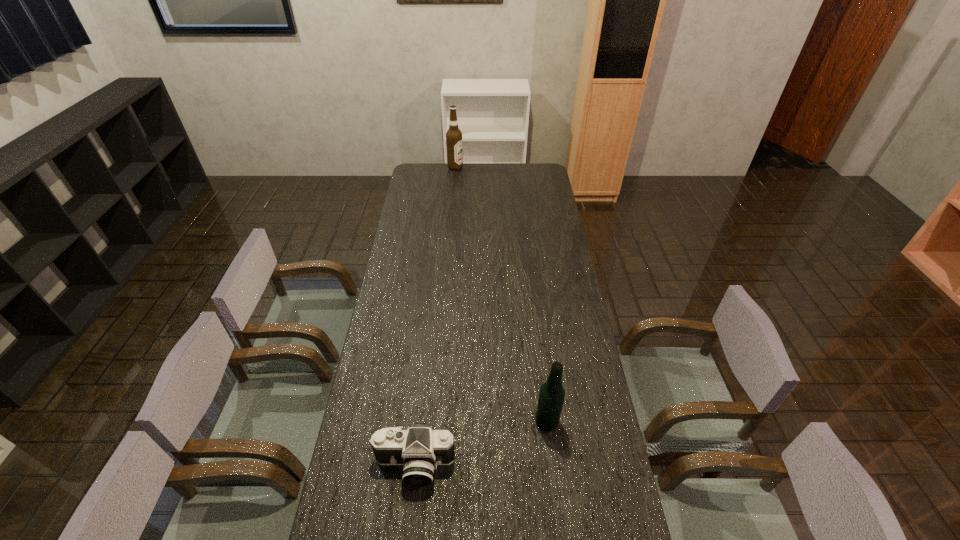
Image resolution: width=960 pixels, height=540 pixels. I want to click on object at the left edge, so click(420, 449).

Image resolution: width=960 pixels, height=540 pixels. In order to click on object at the right edge in this screenshot , I will do `click(551, 397)`.

Find the location of a particular element. This screenshot has width=960, height=540. vacant position at the far edge of the desktop is located at coordinates (492, 170).

Locate an element on the screen. This screenshot has width=960, height=540. vacant space at the left edge is located at coordinates (408, 225).

Identify the location of vacant region at the right edge of the desktop. click(x=612, y=510).

The width and height of the screenshot is (960, 540). I want to click on vacant position at the far left corner of the desktop, so click(423, 174).

In the image, there is a desktop. Identify the location of vacant space at the far right corner. (520, 165).

The height and width of the screenshot is (540, 960). What are the coordinates of `empty location between the farther alcohol and the camera` in the screenshot? It's located at (435, 316).

You are a GUI agent. You are given a task and a screenshot of the screen. Output one action in this format:
    pyautogui.click(x=<x>, y=<y>)
    Task: Click on the empty space between the shortest object and the taller alcohol
    This screenshot has height=540, width=960.
    Given the screenshot: What is the action you would take?
    pyautogui.click(x=435, y=316)

In order to click on vacant space that's between the nearest object and the farther alcohol in this screenshot , I will do `click(435, 316)`.